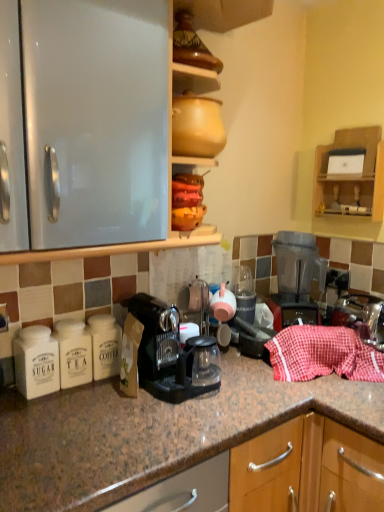
You are a GUI agent. You are given a task and a screenshot of the screen. Output one action in this format:
    pyautogui.click(x=<x>, y=<y>)
    Task: Click on the black plastic coffee machine at center
    The height and width of the screenshot is (512, 384).
    Given the screenshot: What is the action you would take?
    pyautogui.click(x=165, y=352)

Locate an element on the screen. transparent plastic blender at right is located at coordinates (294, 279).

Measure the distance between matte glass tea pot at center and camera.

matte glass tea pot at center and camera are 1.64 meters apart.

This screenshot has width=384, height=512. I want to click on red checkered cloth at right, so click(323, 354).

Is matte glass tea pot at center looking in the opposite direction of black plastic coffee machine at center?

matte glass tea pot at center is not turned away from black plastic coffee machine at center.

Is the position of matte glass tea pot at center less distant than that of black plastic coffee machine at center?

No, it is behind black plastic coffee machine at center.

Would you consider matte glass tea pot at center to be distant from black plastic coffee machine at center?

Actually, matte glass tea pot at center and black plastic coffee machine at center are a little close together.

How many degrees apart are the facing directions of matte glass tea pot at center and black plastic coffee machine at center?

The angular difference between matte glass tea pot at center and black plastic coffee machine at center is 1.51 degrees.

Is matte glass tea pot at center positioned before wooden shelf at upper right?

Yes, it is.

Is matte glass tea pot at center bigger than wooden shelf at upper right?

Incorrect, matte glass tea pot at center is not larger than wooden shelf at upper right.

Which is in front, point (196, 290) or point (348, 187)?

Positioned in front is point (196, 290).

From a real-world perspective, which object rests below the other?

matte glass tea pot at center is physically lower.

Would you say black plastic coffee machine at center is part of wooden shelf at upper right's contents?

Actually, black plastic coffee machine at center is outside wooden shelf at upper right.

From the picture: Is wooden shelf at upper right aimed at black plastic coffee machine at center?

Yes, wooden shelf at upper right is turned towards black plastic coffee machine at center.

From the image's perspective, which is above, wooden shelf at upper right or black plastic coffee machine at center?

From the image's view, wooden shelf at upper right is above.

At what (x,y) coordinates should I click in order to perform the action: click on material in front of the matte glass tea pot at center. Please return your answer as a coordinate pair (x, y). This screenshot has height=512, width=384. Looking at the image, I should click on (323, 354).

From a real-world perspective, is matte glass tea pot at center positioned under red checkered cloth at right based on gravity?

No.

Does matte glass tea pot at center lie behind red checkered cloth at right?

That is True.

Is black plastic coffee machine at center inside transparent plastic blender at right?

That's incorrect, black plastic coffee machine at center is not inside transparent plastic blender at right.

Does transparent plastic blender at right have a greater width compared to black plastic coffee machine at center?

In fact, transparent plastic blender at right might be narrower than black plastic coffee machine at center.

From a real-world perspective, which object rests below the other?

In real-world perspective, black plastic coffee machine at center is lower.

Measure the distance from transparent plastic blender at right to black plastic coffee machine at center.

transparent plastic blender at right and black plastic coffee machine at center are 21.59 inches apart.

Is wooden shelf at upper right in contact with red checkered cloth at right?

No, wooden shelf at upper right is not with red checkered cloth at right.

Which object is further away from the camera, wooden shelf at upper right or red checkered cloth at right?

wooden shelf at upper right is behind.

Which is more to the right, wooden shelf at upper right or red checkered cloth at right?

From the viewer's perspective, wooden shelf at upper right appears more on the right side.

Is point (371, 197) positioned before point (345, 361)?

No, it is behind (345, 361).

Considering the points (312, 236) and (373, 163), which point is in front, point (312, 236) or point (373, 163)?

Positioned in front is point (373, 163).

Could you tell me if transparent plastic blender at right is turned towards wooden shelf at upper right?

No, transparent plastic blender at right is not turned towards wooden shelf at upper right.

Considering the relative positions of transparent plastic blender at right and wooden shelf at upper right in the image provided, is transparent plastic blender at right to the right of wooden shelf at upper right from the viewer's perspective?

No, transparent plastic blender at right is not to the right of wooden shelf at upper right.

Is transparent plastic blender at right far from wooden shelf at upper right?

No, there isn't a large distance between transparent plastic blender at right and wooden shelf at upper right.

Identify the location of tea pot on the right side of black plastic coffee machine at center. (198, 295).

Identify the location of tea pot on the left side of wooden shelf at upper right. The width and height of the screenshot is (384, 512). (198, 295).

Estimate the real-world distances between objects in this image. Which object is closer to black plastic coffee machine at center, transparent plastic blender at right or red checkered cloth at right?

Based on the image, red checkered cloth at right appears to be nearer to black plastic coffee machine at center.

Looking at the image, which one is located further to wooden shelf at upper right, matte glass tea pot at center or transparent plastic blender at right?

Based on the image, matte glass tea pot at center appears to be further to wooden shelf at upper right.

Based on their spatial positions, is transparent plastic blender at right or black plastic coffee machine at center further from matte glass tea pot at center?

transparent plastic blender at right is further to matte glass tea pot at center.

Based on their spatial positions, is red checkered cloth at right or transparent plastic blender at right further from black plastic coffee machine at center?

transparent plastic blender at right is positioned further to the anchor black plastic coffee machine at center.

From the image, which object appears to be nearer to red checkered cloth at right, transparent plastic blender at right or black plastic coffee machine at center?

transparent plastic blender at right lies closer to red checkered cloth at right than the other object.

When comparing their distances from red checkered cloth at right, does black plastic coffee machine at center or wooden shelf at upper right seem closer?

Based on the image, black plastic coffee machine at center appears to be nearer to red checkered cloth at right.

Which object lies further to the anchor point transparent plastic blender at right, black plastic coffee machine at center or wooden shelf at upper right?

black plastic coffee machine at center is further to transparent plastic blender at right.

Based on their spatial positions, is red checkered cloth at right or matte glass tea pot at center further from transparent plastic blender at right?

matte glass tea pot at center is positioned further to the anchor transparent plastic blender at right.

Find the location of `home appliance between black plastic coffee machine at center and red checkered cloth at right`. home appliance between black plastic coffee machine at center and red checkered cloth at right is located at coordinates (294, 279).

The image size is (384, 512). I want to click on home appliance between wooden shelf at upper right and red checkered cloth at right in the up-down direction, so pyautogui.click(x=294, y=279).

Locate an element on the screen. This screenshot has width=384, height=512. home appliance between matte glass tea pot at center and red checkered cloth at right in the horizontal direction is located at coordinates (294, 279).

At what (x,y) coordinates should I click in order to perform the action: click on tea pot between wooden shelf at upper right and red checkered cloth at right vertically. Please return your answer as a coordinate pair (x, y). This screenshot has height=512, width=384. Looking at the image, I should click on (198, 295).